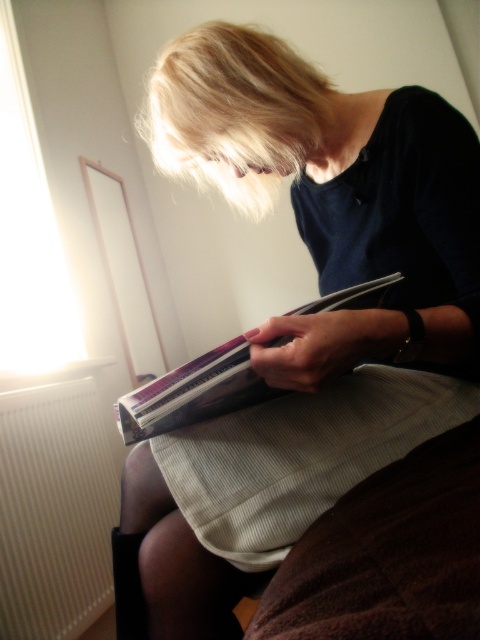
You are a photographer trying to capture the matte black clutch at center and the white ribbed radiator at lower left in a single shot. Based on their positions, which object would appear larger in the photo?

The matte black clutch at center appears larger in the photo because it is closer to the viewer than the white ribbed radiator at lower left.

You are organizing a small shelf in the room and want to place the matte black clutch at center and the striped fabric book at center side by side. Since the shelf is narrow, can you fit both items next to each other without overlapping?

The matte black clutch at center is bigger than striped fabric book at center, so together they might exceed the shelf width. Check their combined size against the shelf space.

You are a photographer trying to capture the perfect shot of the scene. You want to place a small prop exactly where the matte black clutch at center is currently located. According to the coordinates provided, where should you position the new prop in the frame?

The matte black clutch at center is located at coordinates point (302, 317), so you should position the new prop at that exact point to match its current location.